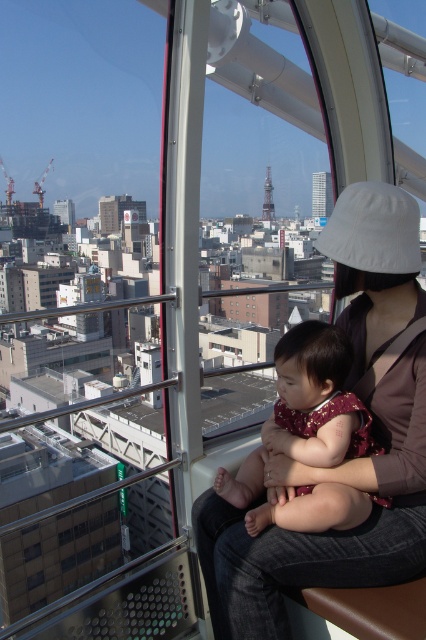
Question: Is white fabric hat at upper right positioned behind maroon fabric baby at center?

Choices:
 (A) yes
 (B) no

Answer: (B)

Question: Does white fabric hat at upper right have a lesser width compared to transparent glass window at center?

Choices:
 (A) yes
 (B) no

Answer: (B)

Question: Which point is closer to the camera?

Choices:
 (A) white fabric hat at upper right
 (B) maroon fabric baby at center

Answer: (A)

Question: Does white fabric hat at upper right appear on the left side of transparent glass window at center?

Choices:
 (A) no
 (B) yes

Answer: (A)

Question: Which object is the farthest from the maroon fabric baby at center?

Choices:
 (A) transparent glass window at center
 (B) white fabric hat at upper right

Answer: (A)

Question: Which object appears closest to the camera in this image?

Choices:
 (A) white fabric hat at upper right
 (B) transparent glass window at center

Answer: (A)